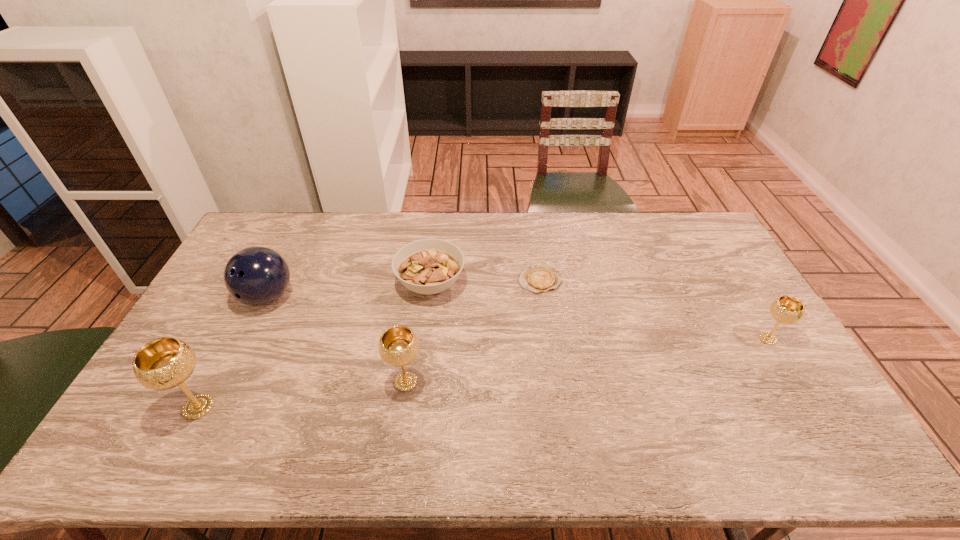
Identify the location of free space that satisfies the following two spatial constraints: 1. on the front side of the shortest object; 2. on the left side of the farthest chalice. tap(549, 339).

This screenshot has height=540, width=960. Identify the location of vacant area that satisfies the following two spatial constraints: 1. on the surface of the second shortest chalice near the finger holes; 2. on the right side of the bowling ball. (226, 382).